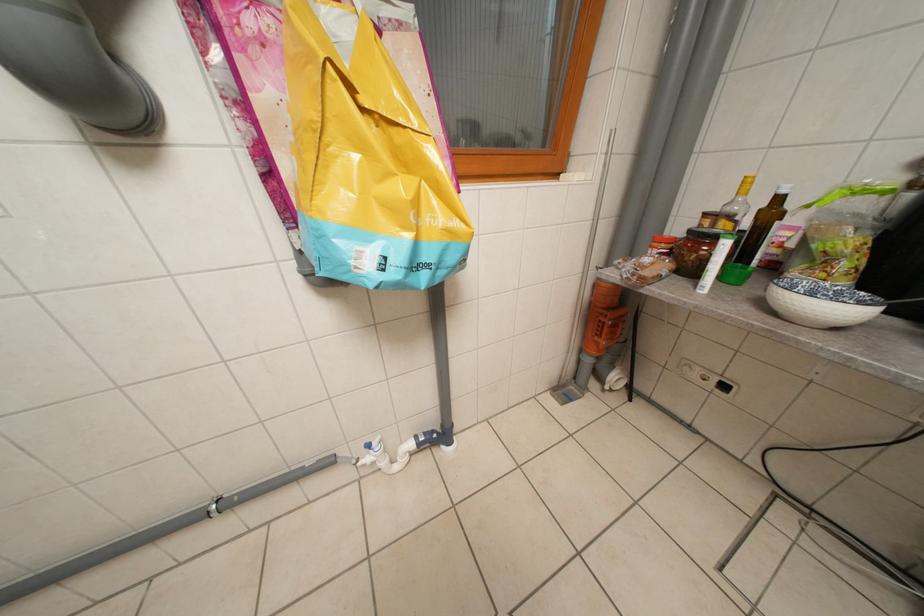
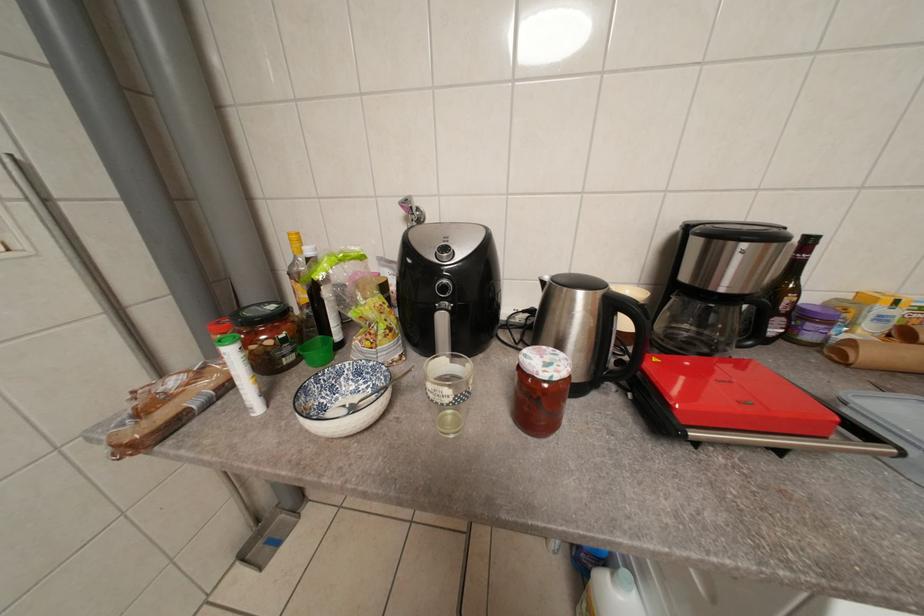
Question: How did the camera likely rotate?

Choices:
 (A) Left
 (B) Right
 (C) Up
 (D) Down

Answer: (B)